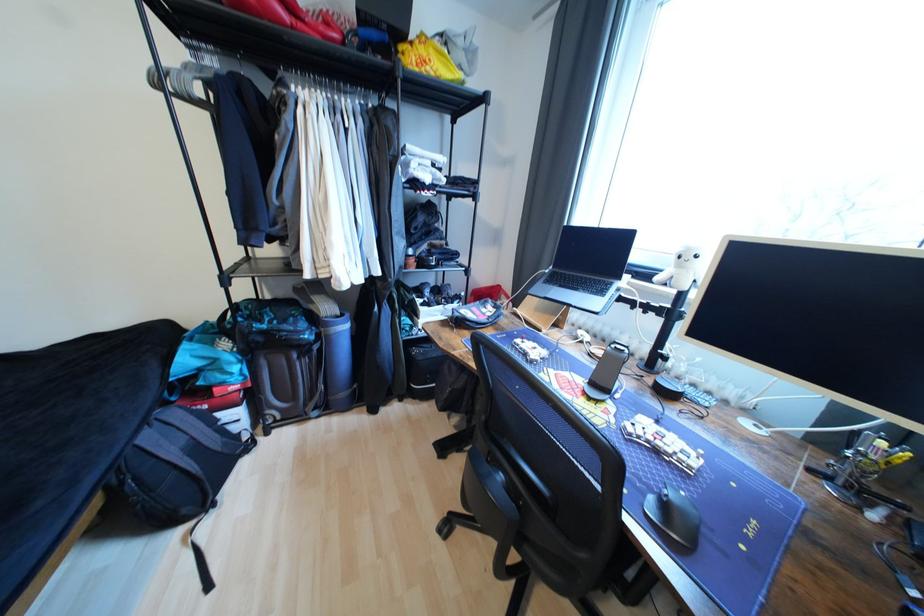
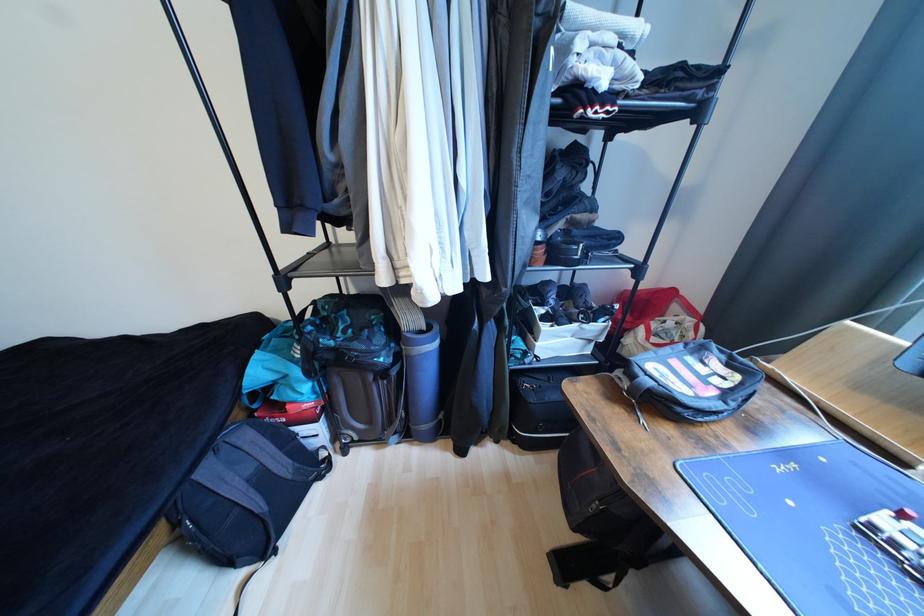
Question: The images are taken continuously from a first-person perspective. In which direction is your viewpoint rotating?

Choices:
 (A) Left
 (B) Right
 (C) Up
 (D) Down

Answer: (A)